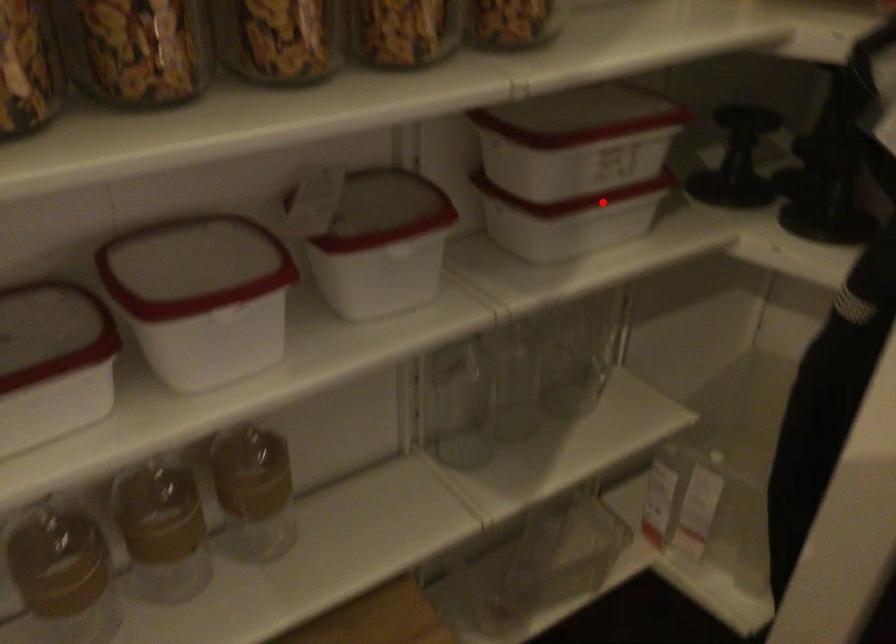
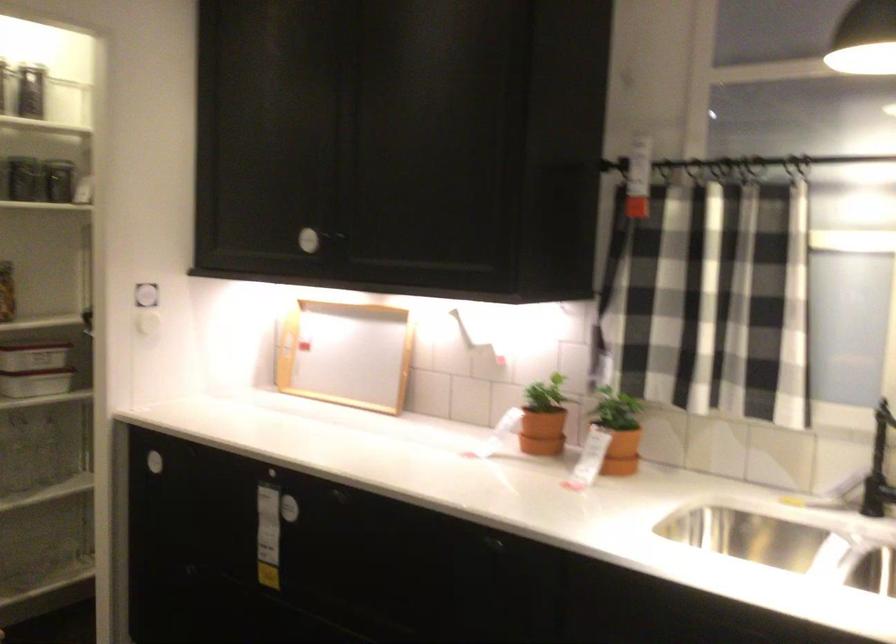
Question: I am providing you with two images of the same scene from different viewpoints. In image1, a red point is highlighted. Considering the same 3D point in image2, which of the following is correct?

Choices:
 (A) It is closer
 (B) It is farther

Answer: (B)